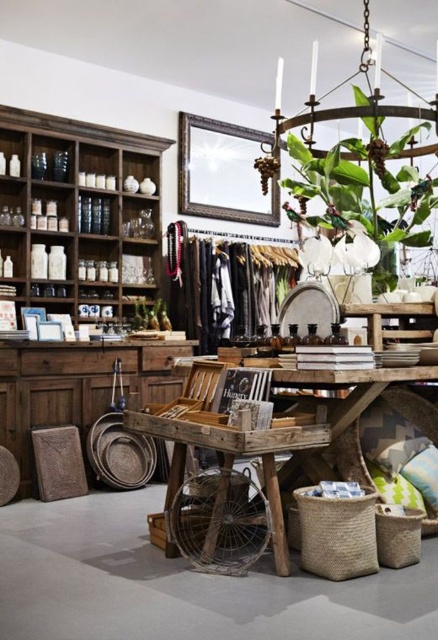
Between point (49, 170) and point (320, 115), which one is positioned in front?

Positioned in front is point (320, 115).

Does dark brown wood shelves at upper left appear on the left side of green leafy plant at upper center?

Yes, dark brown wood shelves at upper left is to the left of green leafy plant at upper center.

Locate an element on the screen. dark brown wood shelves at upper left is located at coordinates (78, 214).

Who is more distant from viewer, (32, 224) or (434, 508)?

The point (32, 224) is behind.

Does dark brown wood shelves at upper left come behind fluffy green pillow at lower right?

That is True.

Is point (127, 161) more distant than point (437, 513)?

Yes.

This screenshot has height=640, width=438. In order to click on dark brown wood shelves at upper left in this screenshot , I will do 78,214.

Which is in front, point (363, 150) or point (434, 460)?

Positioned in front is point (434, 460).

Is the position of green leafy plant at upper center less distant than that of fluffy green pillow at lower right?

Yes, it is in front of fluffy green pillow at lower right.

Where is `green leafy plant at upper center`? This screenshot has width=438, height=640. green leafy plant at upper center is located at coordinates (366, 179).

At what (x,y) coordinates should I click in order to perform the action: click on green leafy plant at upper center. Please return your answer as a coordinate pair (x, y). Image resolution: width=438 pixels, height=640 pixels. Looking at the image, I should click on (366, 179).